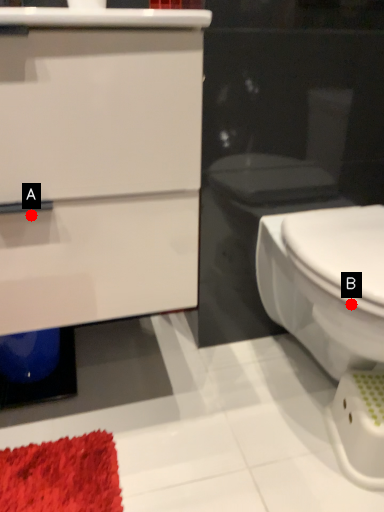
Question: Two points are circled on the image, labeled by A and B beside each circle. Among these points, which one is farthest from the camera?

Choices:
 (A) A is further
 (B) B is further

Answer: (B)